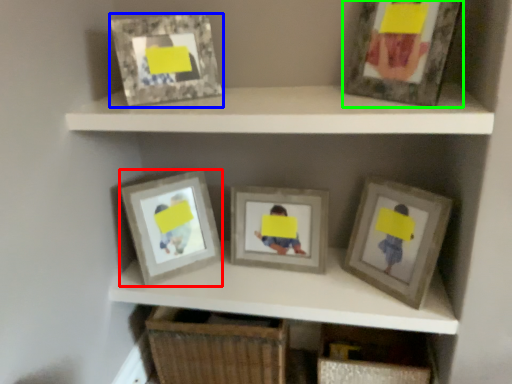
Question: Considering the real-world distances, which object is farthest from picture frame (highlighted by a red box)? picture frame (highlighted by a blue box) or picture frame (highlighted by a green box)?

Choices:
 (A) picture frame
 (B) picture frame

Answer: (B)